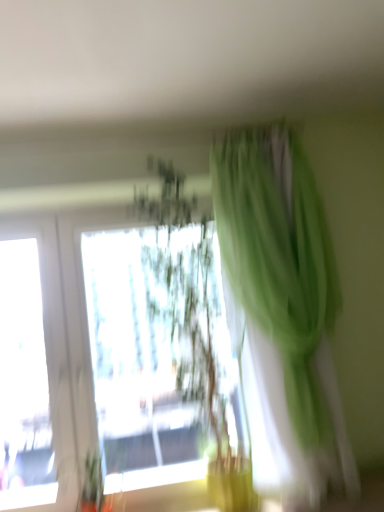
Question: Is green sheer curtain at upper right to the left or to the right of translucent green plant at center in the image?

Choices:
 (A) left
 (B) right

Answer: (B)

Question: Is green sheer curtain at upper right taller or shorter than translucent green plant at center?

Choices:
 (A) tall
 (B) short

Answer: (B)

Question: Is point (307, 252) closer or farther from the camera than point (172, 229)?

Choices:
 (A) farther
 (B) closer

Answer: (B)

Question: Considering the positions of translucent green plant at center and green sheer curtain at upper right in the image, is translucent green plant at center bigger or smaller than green sheer curtain at upper right?

Choices:
 (A) small
 (B) big

Answer: (B)

Question: Is point (220, 498) closer or farther from the camera than point (283, 464)?

Choices:
 (A) farther
 (B) closer

Answer: (A)

Question: Is translucent green plant at center spatially inside green sheer curtain at upper right, or outside of it?

Choices:
 (A) outside
 (B) inside

Answer: (A)

Question: In terms of height, does translucent green plant at center look taller or shorter compared to green sheer curtain at upper right?

Choices:
 (A) short
 (B) tall

Answer: (B)